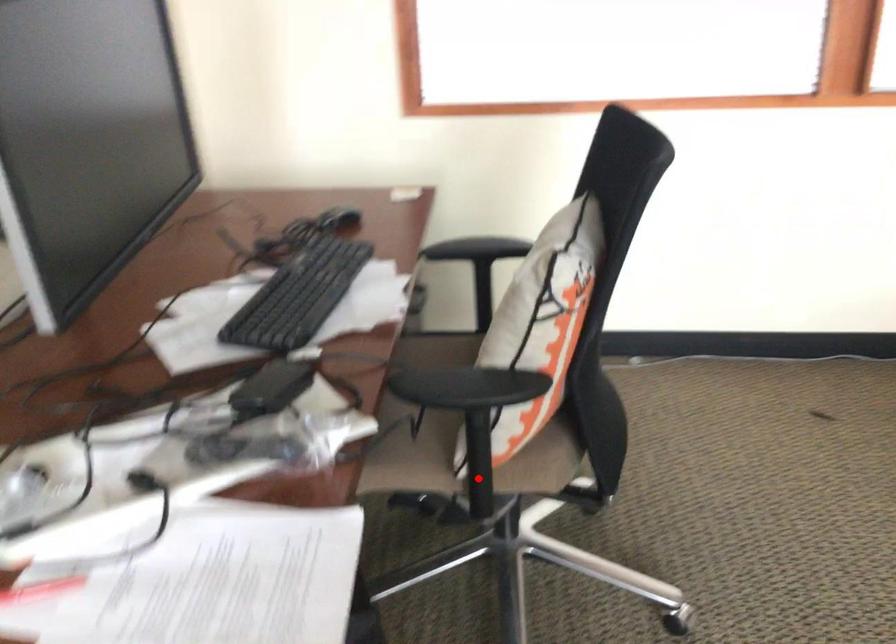
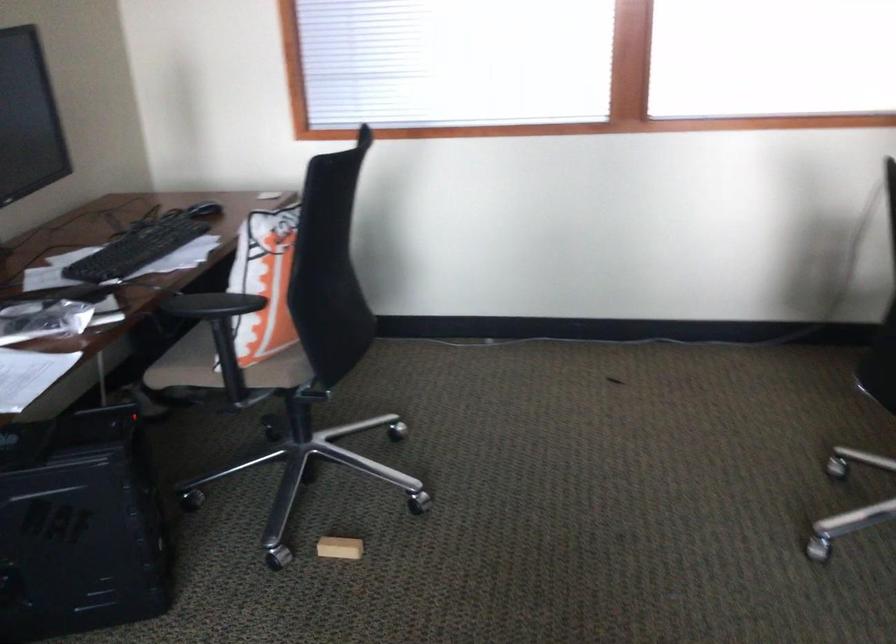
The point at the highlighted location is marked in the first image. Where is the corresponding point in the second image?

(228, 370)